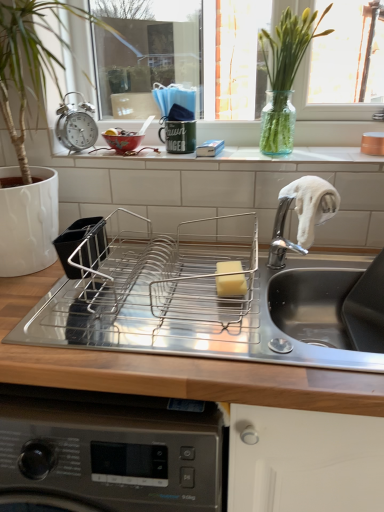
At what (x,y) coordinates should I click in order to perform the action: click on empty space that is to the right of green glass vase at upper center. Please return your answer as a coordinate pair (x, y). The width and height of the screenshot is (384, 512). Looking at the image, I should click on (337, 152).